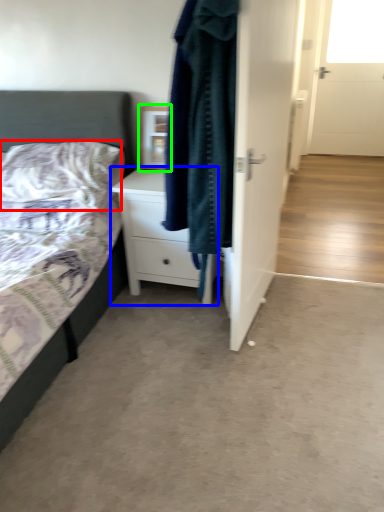
Question: Estimate the real-world distances between objects in this image. Which object is closer to pillow (highlighted by a red box), chest of drawers (highlighted by a blue box) or picture frame (highlighted by a green box)?

Choices:
 (A) chest of drawers
 (B) picture frame

Answer: (A)